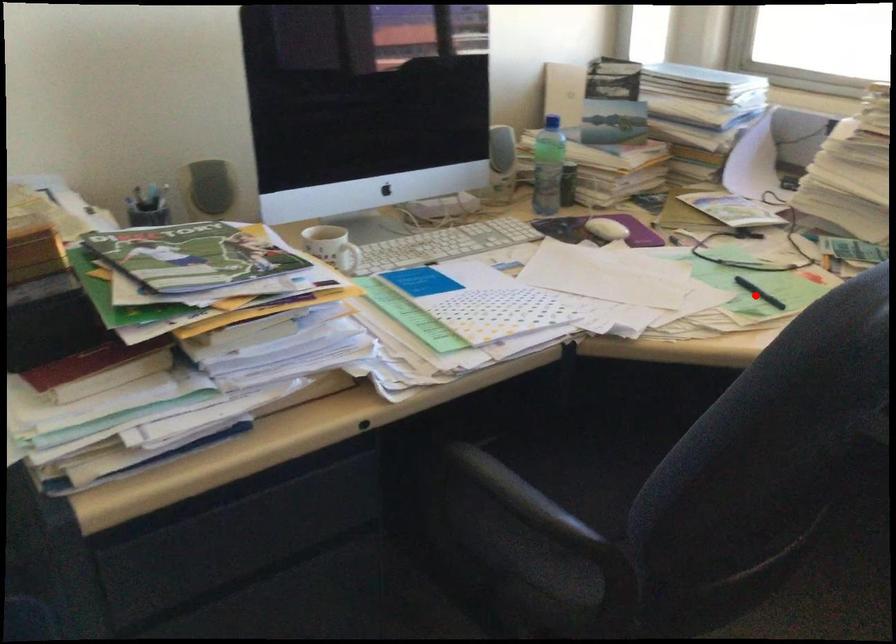
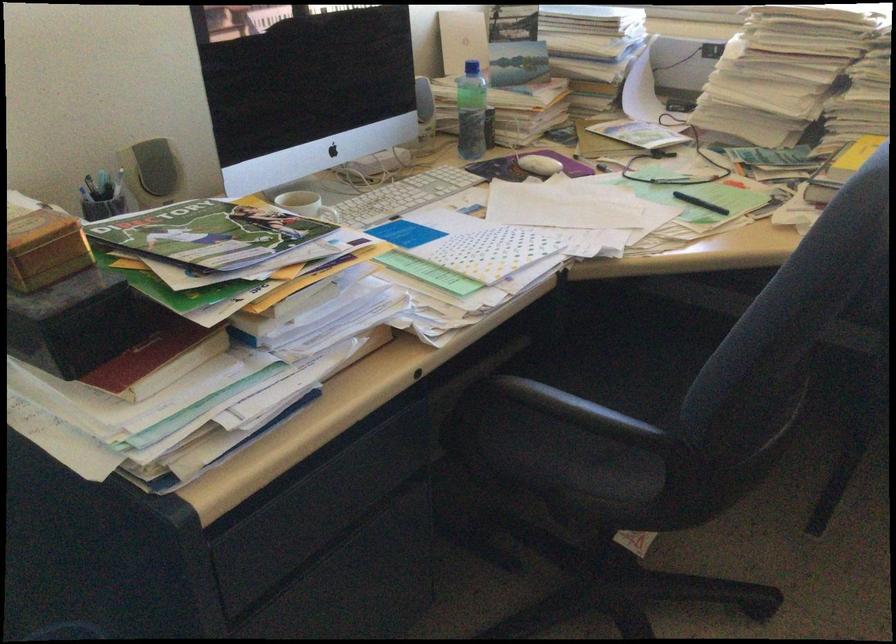
Locate, in the second image, the point that corresponds to the highlighted location in the first image.

(700, 203)